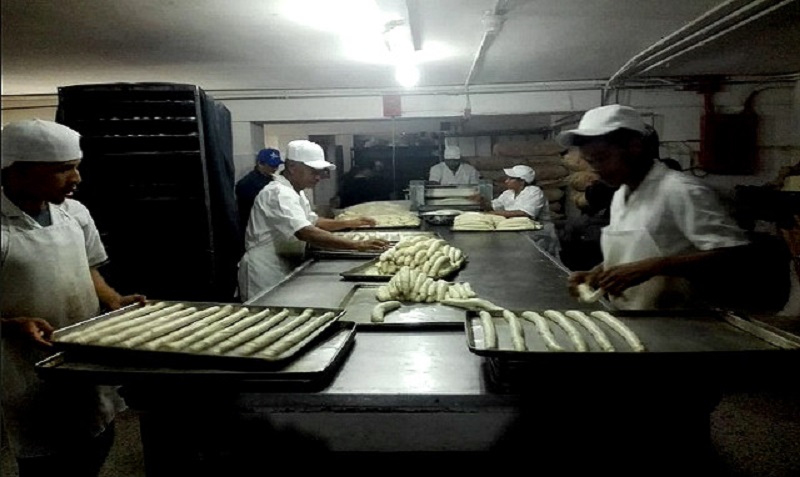
Find the location of a particular element. The width and height of the screenshot is (800, 477). tray is located at coordinates (300, 345).